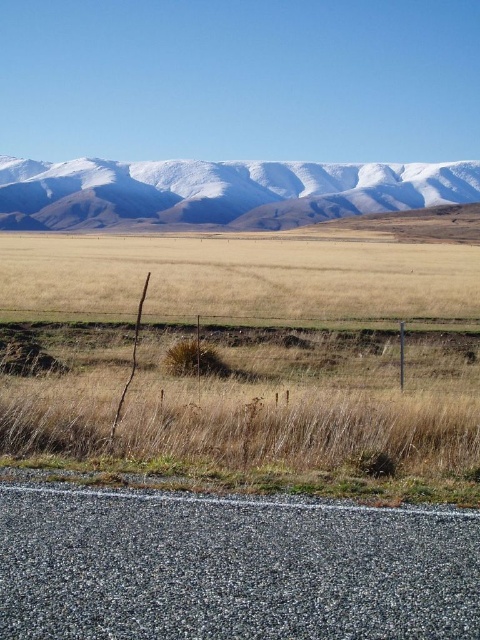
Question: Which of the following is the closest to the observer?

Choices:
 (A) (227, 332)
 (B) (284, 177)

Answer: (A)

Question: Does white snow-covered mountain range at upper center appear on the right side of brown wire fence at center?

Choices:
 (A) no
 (B) yes

Answer: (B)

Question: Is white snow-covered mountain range at upper center smaller than brown wire fence at center?

Choices:
 (A) yes
 (B) no

Answer: (B)

Question: Does white snow-covered mountain range at upper center lie behind brown wire fence at center?

Choices:
 (A) no
 (B) yes

Answer: (B)